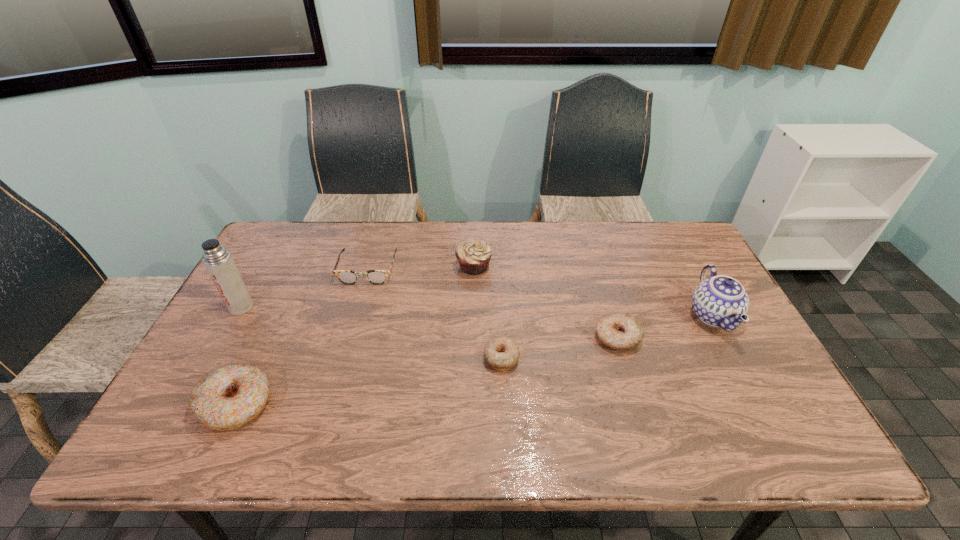
Locate an element on the screen. The height and width of the screenshot is (540, 960). the second tallest object is located at coordinates (720, 301).

At what (x,y) coordinates should I click in order to perform the action: click on vacant space positioned on the back of the nearest doughnut. Please return your answer as a coordinate pair (x, y). This screenshot has width=960, height=540. Looking at the image, I should click on (293, 280).

Where is `free point located on the left of the shortest doughnut`? free point located on the left of the shortest doughnut is located at coordinates (396, 357).

This screenshot has height=540, width=960. In order to click on free point located on the right of the rightmost doughnut in this screenshot , I will do `click(708, 337)`.

Where is `vacant space positioned 0.060m on the back of the thermos bottle`? Image resolution: width=960 pixels, height=540 pixels. vacant space positioned 0.060m on the back of the thermos bottle is located at coordinates (253, 285).

The width and height of the screenshot is (960, 540). In order to click on vacant position located 0.230m on the frame of the third object from left to right in this screenshot , I will do `click(347, 344)`.

This screenshot has height=540, width=960. Identify the location of vacant area located on the left of the third tallest object. (372, 266).

Image resolution: width=960 pixels, height=540 pixels. I want to click on vacant region located 0.130m at the spout of the sixth shortest object, so click(x=642, y=316).

I want to click on free location located 0.170m at the spout of the sixth shortest object, so click(629, 316).

The width and height of the screenshot is (960, 540). What are the coordinates of `free spot located 0.300m at the spout of the sixth shortest object` in the screenshot? It's located at coord(583,316).